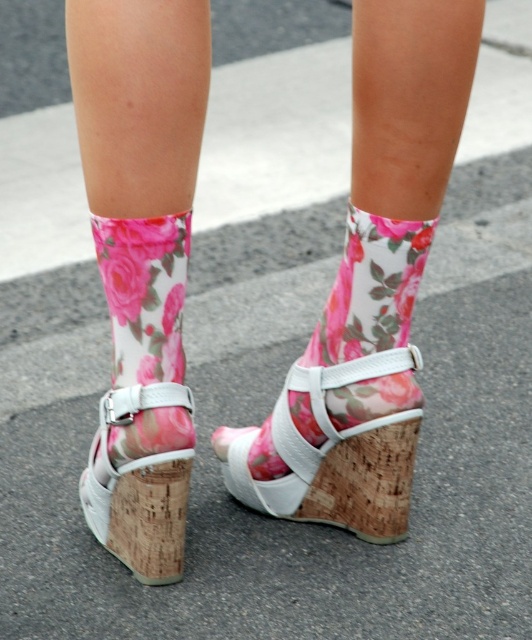
Question: Can you confirm if floral fabric sock at lower center is wider than white cork wedge at lower center?

Choices:
 (A) no
 (B) yes

Answer: (A)

Question: Which of the following is the closest to the observer?

Choices:
 (A) floral socks at center
 (B) floral fabric sock at lower center
 (C) white cork wedge at lower center

Answer: (A)

Question: Which point is closer to the camera taking this photo?

Choices:
 (A) (121, 266)
 (B) (182, 509)
 (C) (237, 438)
 (D) (367, 232)

Answer: (A)

Question: Can you confirm if floral fabric sock at lower center is smaller than white cork wedge at lower center?

Choices:
 (A) no
 (B) yes

Answer: (B)

Question: Does floral fabric sock at lower center have a smaller size compared to white cork wedge at lower center?

Choices:
 (A) yes
 (B) no

Answer: (A)

Question: Which point is farther to the camera?

Choices:
 (A) (187, 461)
 (B) (86, 508)

Answer: (B)